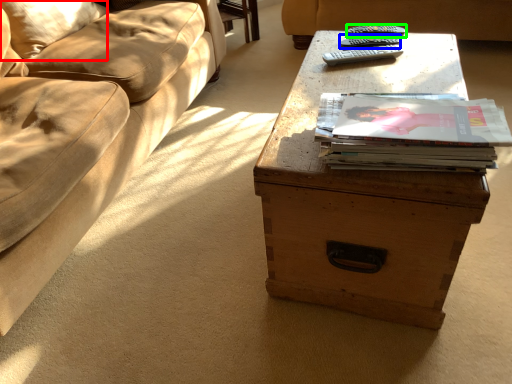
Question: Which object is positioned farthest from pillow (highlighted by a red box)? Select from remote (highlighted by a blue box) and remote (highlighted by a green box).

Choices:
 (A) remote
 (B) remote

Answer: (B)